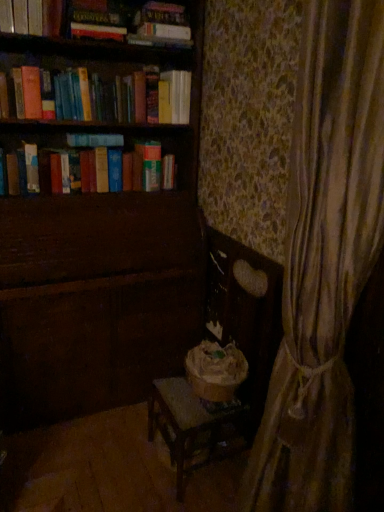
Describe the element at coordinates (97, 31) in the screenshot. The width and height of the screenshot is (384, 512). I see `hardcover book at upper center, placed as the second paperback book when sorted from right to left` at that location.

Identify the location of hardcover book at upper center, the 3th paperback book when ordered from bottom to top. [x=164, y=31].

Image resolution: width=384 pixels, height=512 pixels. Describe the element at coordinates (164, 31) in the screenshot. I see `hardcover book at upper center, the 3th paperback book when ordered from bottom to top` at that location.

Identify the location of wooden chair at lower center. The image size is (384, 512). (97, 246).

Is hardcover book at upper center, which ranks as the 3th paperback book in left-to-right order, not within hardcover book at left, which is the third paperback book in right-to-left order?

Absolutely, hardcover book at upper center, which ranks as the 3th paperback book in left-to-right order, is external to hardcover book at left, which is the third paperback book in right-to-left order.

Is hardcover book at upper center, the 3th paperback book when ordered from bottom to top, to the right of hardcover book at left, placed as the 1th paperback book when sorted from bottom to top, from the viewer's perspective?

Indeed, hardcover book at upper center, the 3th paperback book when ordered from bottom to top, is positioned on the right side of hardcover book at left, placed as the 1th paperback book when sorted from bottom to top.

Can you confirm if hardcover book at upper center, marked as the 1th paperback book in a top-to-bottom arrangement, is shorter than hardcover book at left, which is the third paperback book in right-to-left order?

Yes, hardcover book at upper center, marked as the 1th paperback book in a top-to-bottom arrangement, is shorter than hardcover book at left, which is the third paperback book in right-to-left order.

Is point (147, 24) positioned after point (36, 176)?

Yes.

Between point (206, 444) and point (33, 157), which one is positioned in front?

The point (206, 444) is more forward.

Is wooden rocking chair at center positioned far away from hardcover book at left, placed as the 1th paperback book when sorted from bottom to top?

Yes.

From the picture: Is wooden rocking chair at center turned away from hardcover book at left, which is the third paperback book in right-to-left order?

No, wooden rocking chair at center's orientation is not away from hardcover book at left, which is the third paperback book in right-to-left order.

Considering the relative sizes of wooden rocking chair at center and hardcover book at left, placed as the 1th paperback book when sorted from bottom to top, in the image provided, is wooden rocking chair at center wider than hardcover book at left, placed as the 1th paperback book when sorted from bottom to top,?

Correct, the width of wooden rocking chair at center exceeds that of hardcover book at left, placed as the 1th paperback book when sorted from bottom to top.

Considering the relative sizes of hardcover book at upper center, the 3th paperback book when ordered from bottom to top, and wooden chair at lower center in the image provided, is hardcover book at upper center, the 3th paperback book when ordered from bottom to top, taller than wooden chair at lower center?

In fact, hardcover book at upper center, the 3th paperback book when ordered from bottom to top, may be shorter than wooden chair at lower center.

Where is `furniture below the hardcover book at upper center, the 3th paperback book when ordered from bottom to top (from the image's perspective)`? The image size is (384, 512). furniture below the hardcover book at upper center, the 3th paperback book when ordered from bottom to top (from the image's perspective) is located at coordinates [x=97, y=246].

Consider the image. Between hardcover book at upper center, which ranks as the 3th paperback book in left-to-right order, and wooden chair at lower center, which one has smaller width?

hardcover book at upper center, which ranks as the 3th paperback book in left-to-right order.

Considering the points (107, 35) and (157, 392), which point is behind, point (107, 35) or point (157, 392)?

The point (107, 35) is more distant.

Consider the image. Is hardcover book at upper center, which ranks as the 2th paperback book in bottom-to-top order, inside or outside of wooden rocking chair at center?

hardcover book at upper center, which ranks as the 2th paperback book in bottom-to-top order, exists outside the volume of wooden rocking chair at center.

Is hardcover book at upper center, the 2th paperback book in the left-to-right sequence, not near wooden rocking chair at center?

hardcover book at upper center, the 2th paperback book in the left-to-right sequence, is positioned a significant distance from wooden rocking chair at center.

From the image's perspective, between hardcover book at upper center, placed as the second paperback book when sorted from right to left, and wooden rocking chair at center, which one is located above?

hardcover book at upper center, placed as the second paperback book when sorted from right to left, from the image's perspective.

From a real-world perspective, is hardcover book at upper center, marked as the second paperback book in a top-to-bottom arrangement, located higher than wooden chair at lower center?

Yes, from a real-world perspective, hardcover book at upper center, marked as the second paperback book in a top-to-bottom arrangement, is on top of wooden chair at lower center.

Considering the sizes of hardcover book at upper center, which ranks as the 2th paperback book in bottom-to-top order, and wooden chair at lower center in the image, is hardcover book at upper center, which ranks as the 2th paperback book in bottom-to-top order, wider or thinner than wooden chair at lower center?

In the image, hardcover book at upper center, which ranks as the 2th paperback book in bottom-to-top order, appears to be more narrow than wooden chair at lower center.

Could wooden chair at lower center be considered to be inside hardcover book at upper center, which ranks as the 2th paperback book in bottom-to-top order?

Definitely not — wooden chair at lower center is not inside hardcover book at upper center, which ranks as the 2th paperback book in bottom-to-top order.

Who is taller, hardcover book at upper center, placed as the second paperback book when sorted from right to left, or wooden chair at lower center?

wooden chair at lower center is taller.

From a real-world perspective, does wooden rocking chair at center sit lower than hardcover book at upper center, the 3th paperback book when ordered from bottom to top?

Yes.

Is wooden rocking chair at center far away from hardcover book at upper center, the 1th paperback book in the right-to-left sequence?

wooden rocking chair at center is positioned a significant distance from hardcover book at upper center, the 1th paperback book in the right-to-left sequence.

In the scene shown: Considering the relative positions of wooden rocking chair at center and hardcover book at upper center, which ranks as the 3th paperback book in left-to-right order, in the image provided, is wooden rocking chair at center to the left or to the right of hardcover book at upper center, which ranks as the 3th paperback book in left-to-right order,?

In the image, wooden rocking chair at center appears on the right side of hardcover book at upper center, which ranks as the 3th paperback book in left-to-right order.

Is wooden rocking chair at center in front of or behind hardcover book at upper center, which ranks as the 3th paperback book in left-to-right order, in the image?

Visually, wooden rocking chair at center is located in front of hardcover book at upper center, which ranks as the 3th paperback book in left-to-right order.

Is hardcover book at upper center, placed as the second paperback book when sorted from right to left, positioned with its back to hardcover book at upper center, the 1th paperback book in the right-to-left sequence?

No, hardcover book at upper center, placed as the second paperback book when sorted from right to left, is not facing the opposite direction of hardcover book at upper center, the 1th paperback book in the right-to-left sequence.

From the picture: Which of these two, hardcover book at upper center, marked as the second paperback book in a top-to-bottom arrangement, or hardcover book at upper center, the 3th paperback book when ordered from bottom to top, is wider?

hardcover book at upper center, marked as the second paperback book in a top-to-bottom arrangement, is wider.

What are the coordinates of `the 1st paperback book below when counting from the hardcover book at upper center, the 3th paperback book when ordered from bottom to top (from the image's perspective)` in the screenshot? It's located at (97, 31).

Which is in front, hardcover book at upper center, the 2th paperback book in the left-to-right sequence, or hardcover book at upper center, which ranks as the 3th paperback book in left-to-right order?

Positioned in front is hardcover book at upper center, the 2th paperback book in the left-to-right sequence.

Image resolution: width=384 pixels, height=512 pixels. In order to click on the 2nd paperback book to the left of the hardcover book at upper center, the 1th paperback book in the right-to-left sequence, counting from the anchor's position in this screenshot , I will do `click(32, 168)`.

Where is `paperback book that is the 1st object located above the wooden rocking chair at center (from the image's perspective)`? The image size is (384, 512). paperback book that is the 1st object located above the wooden rocking chair at center (from the image's perspective) is located at coordinates coord(32,168).

Looking at this image, based on their spatial positions, is hardcover book at upper center, marked as the second paperback book in a top-to-bottom arrangement, or hardcover book at upper center, the 3th paperback book when ordered from bottom to top, closer to wooden chair at lower center?

hardcover book at upper center, marked as the second paperback book in a top-to-bottom arrangement, is positioned closer to the anchor wooden chair at lower center.

When comparing their distances from wooden rocking chair at center, does hardcover book at upper center, marked as the second paperback book in a top-to-bottom arrangement, or wooden chair at lower center seem closer?

wooden chair at lower center.

Considering their positions, is hardcover book at upper center, which ranks as the 3th paperback book in left-to-right order, positioned closer to hardcover book at upper center, marked as the second paperback book in a top-to-bottom arrangement, than wooden rocking chair at center?

Among the two, hardcover book at upper center, which ranks as the 3th paperback book in left-to-right order, is located nearer to hardcover book at upper center, marked as the second paperback book in a top-to-bottom arrangement.

Considering their positions, is hardcover book at upper center, which ranks as the 3th paperback book in left-to-right order, positioned further to wooden chair at lower center than wooden rocking chair at center?

hardcover book at upper center, which ranks as the 3th paperback book in left-to-right order.

Which object lies further to the anchor point hardcover book at upper center, placed as the second paperback book when sorted from right to left, hardcover book at left, the first paperback book positioned from the left, or hardcover book at upper center, marked as the 1th paperback book in a top-to-bottom arrangement?

hardcover book at left, the first paperback book positioned from the left, is positioned further to the anchor hardcover book at upper center, placed as the second paperback book when sorted from right to left.

Considering their positions, is hardcover book at upper center, marked as the second paperback book in a top-to-bottom arrangement, positioned further to wooden chair at lower center than hardcover book at upper left?

hardcover book at upper center, marked as the second paperback book in a top-to-bottom arrangement, is positioned further to the anchor wooden chair at lower center.

Looking at the image, which one is located further to hardcover book at upper center, the 3th paperback book when ordered from bottom to top, hardcover book at upper left or hardcover book at left, which is the third paperback book in right-to-left order?

Among the two, hardcover book at left, which is the third paperback book in right-to-left order, is located further to hardcover book at upper center, the 3th paperback book when ordered from bottom to top.

Considering their positions, is wooden chair at lower center positioned closer to hardcover book at upper left than hardcover book at upper center, placed as the second paperback book when sorted from right to left?

hardcover book at upper center, placed as the second paperback book when sorted from right to left, is closer to hardcover book at upper left.

Identify the location of furniture between hardcover book at upper center, placed as the second paperback book when sorted from right to left, and wooden rocking chair at center, in the vertical direction. The height and width of the screenshot is (512, 384). (97, 246).

Locate an element on the screen. Image resolution: width=384 pixels, height=512 pixels. book between hardcover book at upper center, the 1th paperback book in the right-to-left sequence, and hardcover book at left, placed as the 1th paperback book when sorted from bottom to top, in the up-down direction is located at coordinates (31, 17).

This screenshot has width=384, height=512. Find the location of `paperback book between hardcover book at upper center, the 2th paperback book in the left-to-right sequence, and wooden rocking chair at center from top to bottom`. paperback book between hardcover book at upper center, the 2th paperback book in the left-to-right sequence, and wooden rocking chair at center from top to bottom is located at coordinates (32, 168).

The height and width of the screenshot is (512, 384). Find the location of `paperback book that lies between hardcover book at upper center, marked as the second paperback book in a top-to-bottom arrangement, and wooden chair at lower center from top to bottom`. paperback book that lies between hardcover book at upper center, marked as the second paperback book in a top-to-bottom arrangement, and wooden chair at lower center from top to bottom is located at coordinates (32, 168).